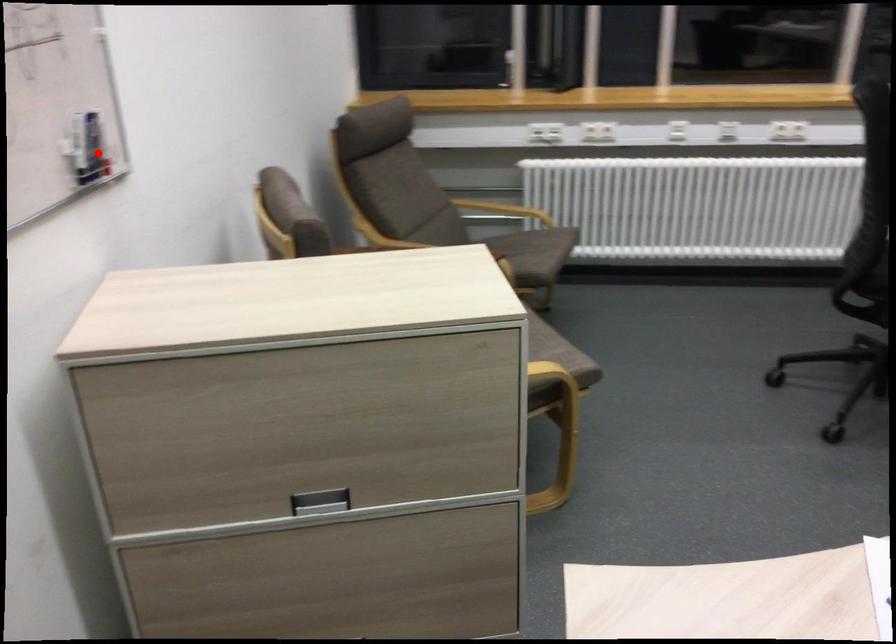
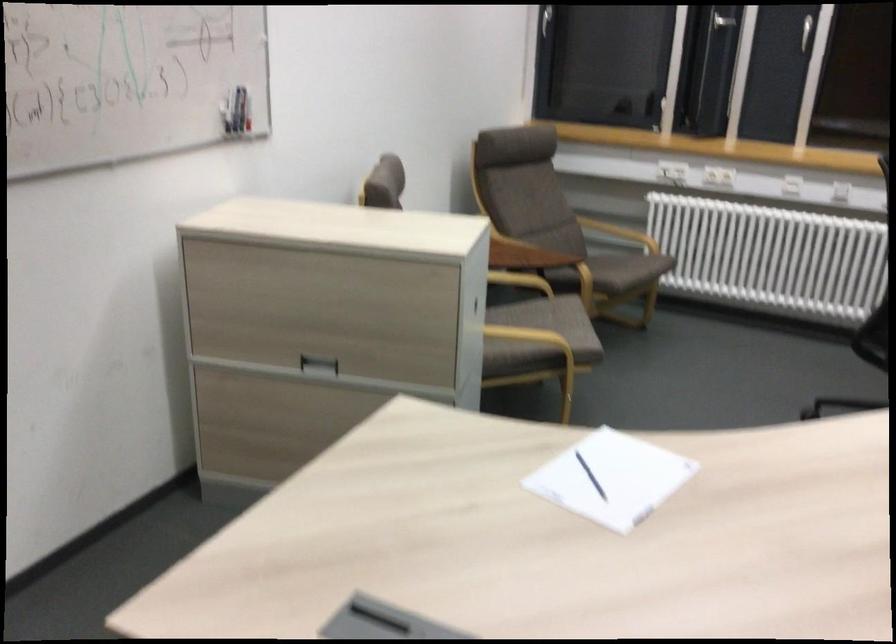
In the second image, find the point that corresponds to the highlighted location in the first image.

(248, 114)